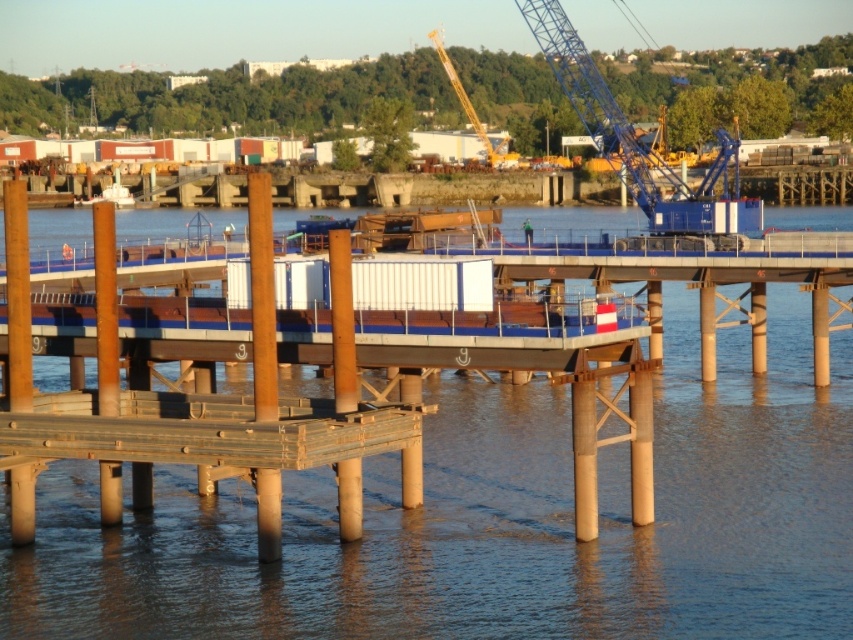
Is brown wooden water at center thinner than yellow metallic crane at upper center?

No.

Is point (529, 588) positioned in front of point (440, 60)?

That is True.

Between point (186, 499) and point (439, 51), which one is positioned behind?

Point (439, 51)

You are a GUI agent. You are given a task and a screenshot of the screen. Output one action in this format:
    pyautogui.click(x=<x>, y=<y>)
    Task: Click on the brown wooden water at center
    Image resolution: width=853 pixels, height=640 pixels.
    Given the screenshot: What is the action you would take?
    pyautogui.click(x=495, y=522)